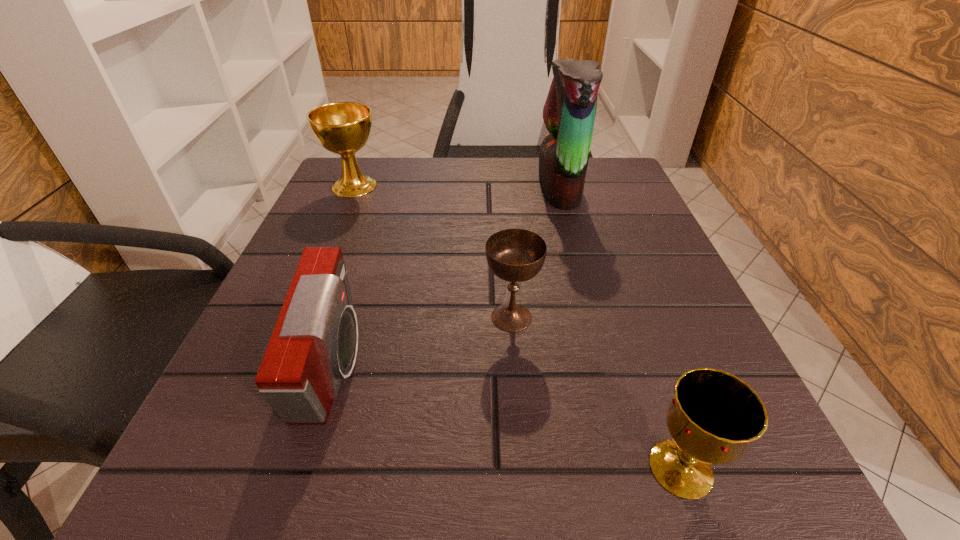
In the image, there is a desktop. Where is `vacant space at the far left corner`? The height and width of the screenshot is (540, 960). vacant space at the far left corner is located at coordinates (390, 158).

Find the location of a particular element. This screenshot has width=960, height=540. blank area at the far right corner is located at coordinates (614, 187).

Locate an element on the screen. This screenshot has width=960, height=540. vacant point located between the leftmost chalice and the second nearest chalice is located at coordinates (433, 252).

Identify the location of vacant area that lies between the farthest chalice and the third object from right to left. Image resolution: width=960 pixels, height=540 pixels. (433, 252).

Where is `free space between the nearest chalice and the tallest object`? The width and height of the screenshot is (960, 540). free space between the nearest chalice and the tallest object is located at coordinates coord(620,328).

You are a GUI agent. You are given a task and a screenshot of the screen. Output one action in this format:
    pyautogui.click(x=<x>, y=<y>)
    Task: Click on the free space between the second nearest chalice and the farthest chalice
    
    Given the screenshot: What is the action you would take?
    pyautogui.click(x=433, y=252)

At what (x,y) coordinates should I click in order to perform the action: click on unoccupied position between the camera and the second nearest chalice. Please return your answer as a coordinate pair (x, y). This screenshot has width=960, height=540. Looking at the image, I should click on (422, 343).

Find the location of `free space between the camera and the parrot`. free space between the camera and the parrot is located at coordinates (446, 278).

I want to click on free space between the camera and the second farthest chalice, so coord(422,343).

At what (x,y) coordinates should I click in order to perform the action: click on object that is the closest to the parrot. Please return your answer as a coordinate pair (x, y). Looking at the image, I should click on (515, 255).